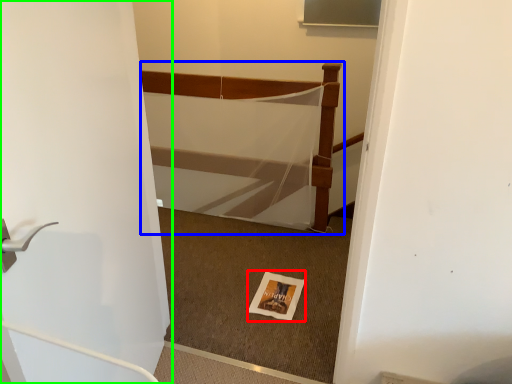
Question: Which object is positioned closest to postcard (highlighted by a red box)? Select from bed (highlighted by a blue box) and door (highlighted by a green box).

Choices:
 (A) bed
 (B) door

Answer: (A)